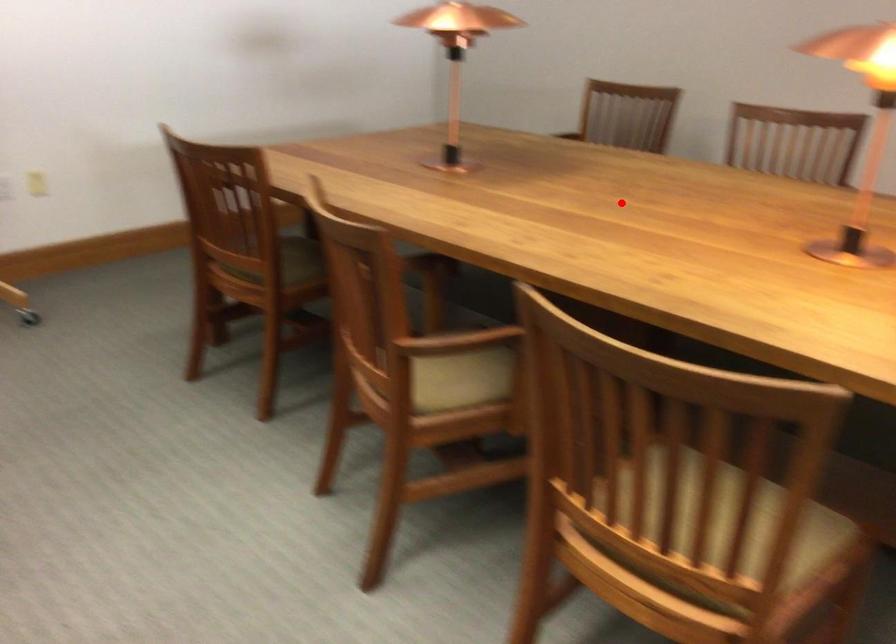
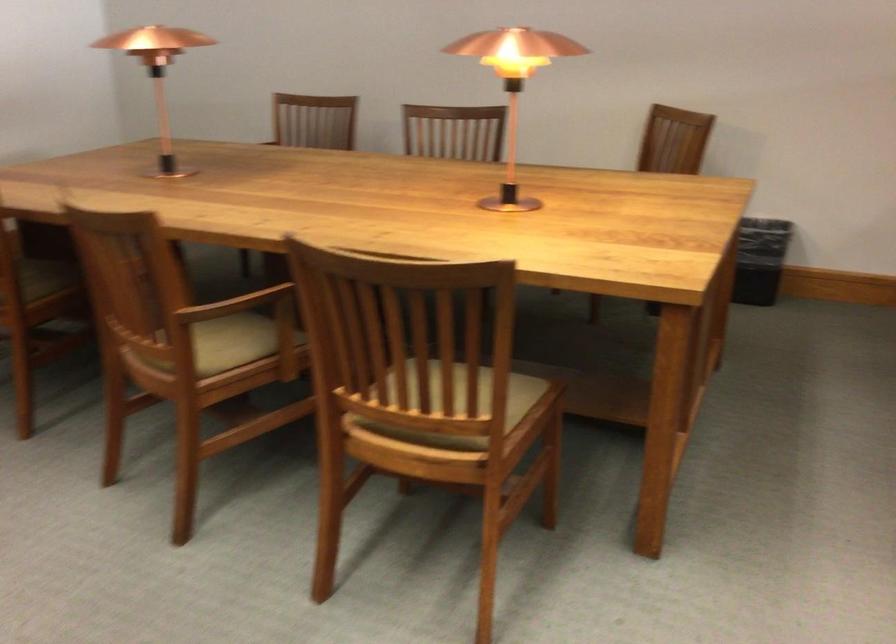
Locate, in the second image, the point that corresponds to the highlighted location in the first image.

(332, 189)